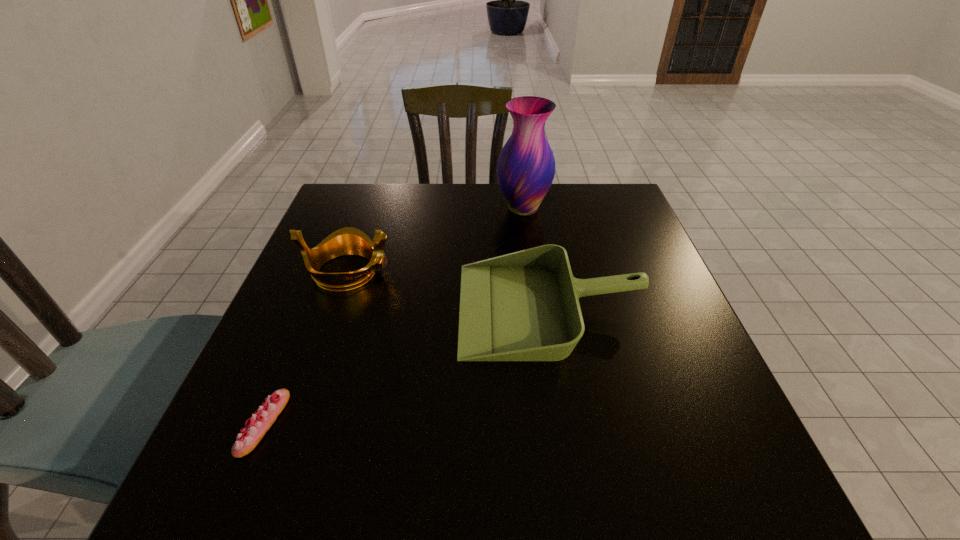
Where is `vacant space at the left edge of the desktop`? vacant space at the left edge of the desktop is located at coordinates (x=228, y=415).

At what (x,y) coordinates should I click in order to perform the action: click on vacant space at the right edge. Please return your answer as a coordinate pair (x, y). The image size is (960, 540). Looking at the image, I should click on (680, 371).

Locate an element on the screen. This screenshot has width=960, height=540. vacant space at the far left corner of the desktop is located at coordinates (342, 211).

Locate an element on the screen. Image resolution: width=960 pixels, height=540 pixels. free region at the far right corner of the desktop is located at coordinates (577, 188).

Image resolution: width=960 pixels, height=540 pixels. I want to click on vacant area that lies between the vase and the third shortest object, so click(436, 240).

Image resolution: width=960 pixels, height=540 pixels. What are the coordinates of `free space that is in between the third shortest object and the vase` in the screenshot? It's located at (436, 240).

Identify the location of blank region between the nearest object and the tallest object. (394, 316).

What are the coordinates of `vacant space in between the eclair and the farthest object` in the screenshot? It's located at (394, 316).

This screenshot has width=960, height=540. In order to click on free area in between the third tallest object and the nearest object in this screenshot , I will do `click(407, 366)`.

Locate an element on the screen. vacant area that lies between the tiara and the dustpan is located at coordinates (448, 289).